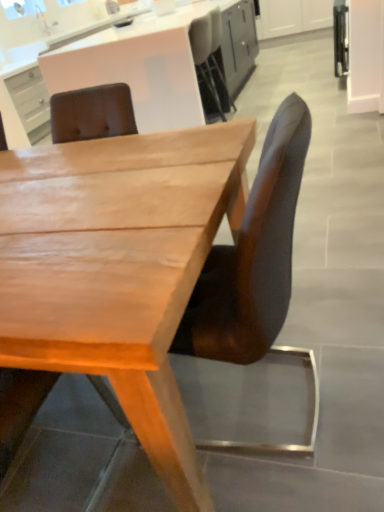
Locate an element on the screen. The width and height of the screenshot is (384, 512). free space above light brown wood desk at center (from a real-world perspective) is located at coordinates (75, 183).